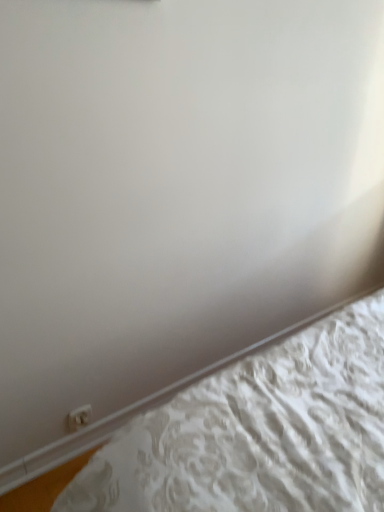
Question: Is white textured mattress at lower right far from white plastic electric outlet at lower left?

Choices:
 (A) no
 (B) yes

Answer: (A)

Question: From a real-world perspective, is white textured mattress at lower right on top of white plastic electric outlet at lower left?

Choices:
 (A) yes
 (B) no

Answer: (B)

Question: Considering the relative positions of white textured mattress at lower right and white plastic electric outlet at lower left in the image provided, is white textured mattress at lower right behind white plastic electric outlet at lower left?

Choices:
 (A) yes
 (B) no

Answer: (B)

Question: Is white textured mattress at lower right to the right of white plastic electric outlet at lower left from the viewer's perspective?

Choices:
 (A) yes
 (B) no

Answer: (A)

Question: Can you confirm if white textured mattress at lower right is taller than white plastic electric outlet at lower left?

Choices:
 (A) yes
 (B) no

Answer: (B)

Question: Is white textured mattress at lower right completely or partially outside of white plastic electric outlet at lower left?

Choices:
 (A) yes
 (B) no

Answer: (A)

Question: From a real-world perspective, is white plastic electric outlet at lower left below white textured mattress at lower right?

Choices:
 (A) no
 (B) yes

Answer: (A)

Question: Is white plastic electric outlet at lower left surrounding white textured mattress at lower right?

Choices:
 (A) yes
 (B) no

Answer: (B)

Question: Does white plastic electric outlet at lower left have a smaller size compared to white textured mattress at lower right?

Choices:
 (A) no
 (B) yes

Answer: (B)

Question: Is white plastic electric outlet at lower left to the left of white textured mattress at lower right from the viewer's perspective?

Choices:
 (A) yes
 (B) no

Answer: (A)

Question: Can you confirm if white plastic electric outlet at lower left is taller than white textured mattress at lower right?

Choices:
 (A) no
 (B) yes

Answer: (B)

Question: Is white plastic electric outlet at lower left thinner than white textured mattress at lower right?

Choices:
 (A) yes
 (B) no

Answer: (A)

Question: Considering their positions, is white textured mattress at lower right located in front of or behind white plastic electric outlet at lower left?

Choices:
 (A) front
 (B) behind

Answer: (A)